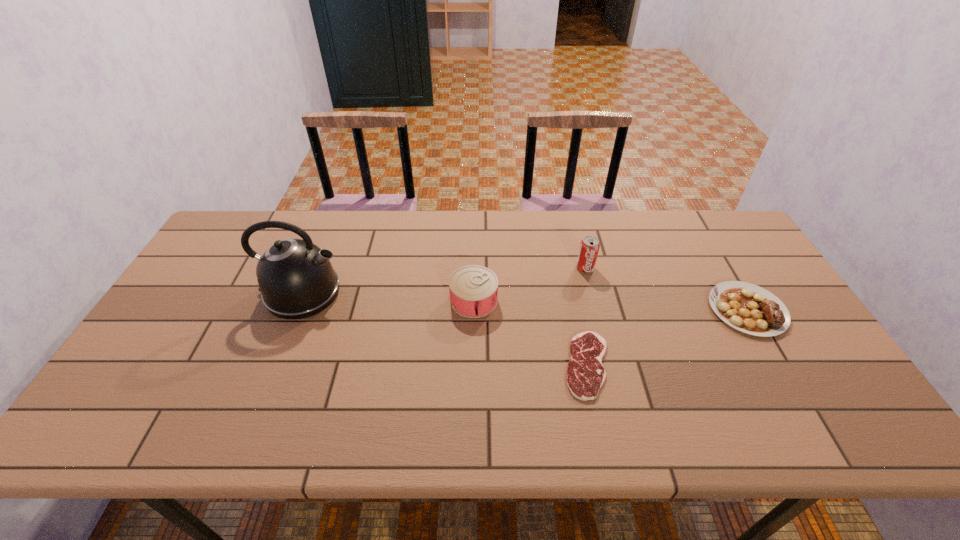
You are a GUI agent. You are given a task and a screenshot of the screen. Output one action in this format:
    pyautogui.click(x=<x>, y=<y>)
    Task: Click on the free space between the kettle and the shortest object
    
    Given the screenshot: What is the action you would take?
    pyautogui.click(x=444, y=329)

Identify which object is the third nearest to the left steak. Please provide its 2D coordinates. Your answer should be formatted as a tuple, i.e. [(x, y)], where the tuple contains the x and y coordinates of a point satisfying the conditions above.

[(751, 309)]

Locate which object is the closest to the kettle. Please provide its 2D coordinates. Your answer should be formatted as a tuple, i.e. [(x, y)], where the tuple contains the x and y coordinates of a point satisfying the conditions above.

[(473, 289)]

The image size is (960, 540). Identify the location of vacant region that satisfies the following two spatial constraints: 1. on the back side of the soda can; 2. on the right side of the third shortest object. (474, 268).

Image resolution: width=960 pixels, height=540 pixels. Identify the location of free spot that satisfies the following two spatial constraints: 1. on the front side of the taller steak; 2. on the right side of the fourth object from right to left. (473, 309).

Where is `blank area in the image that satisfies the following two spatial constraints: 1. on the spout of the rightmost object; 2. on the right side of the leftmost object`? This screenshot has width=960, height=540. blank area in the image that satisfies the following two spatial constraints: 1. on the spout of the rightmost object; 2. on the right side of the leftmost object is located at coordinates (296, 309).

This screenshot has width=960, height=540. I want to click on free region that satisfies the following two spatial constraints: 1. on the back side of the fourth shortest object; 2. on the left side of the left steak, so click(567, 268).

This screenshot has width=960, height=540. What are the coordinates of `vacant space that satisfies the following two spatial constraints: 1. on the back side of the fourth object from right to left; 2. on the left side of the second tallest object` in the screenshot? It's located at (474, 268).

Image resolution: width=960 pixels, height=540 pixels. Find the location of `vacant space that satisfies the following two spatial constraints: 1. on the spout of the tallest object; 2. on the right side of the shortest object`. vacant space that satisfies the following two spatial constraints: 1. on the spout of the tallest object; 2. on the right side of the shortest object is located at coordinates (273, 365).

Find the location of a particular element. Image resolution: width=960 pixels, height=540 pixels. vacant space that satisfies the following two spatial constraints: 1. on the back side of the soda can; 2. on the right side of the left steak is located at coordinates click(567, 268).